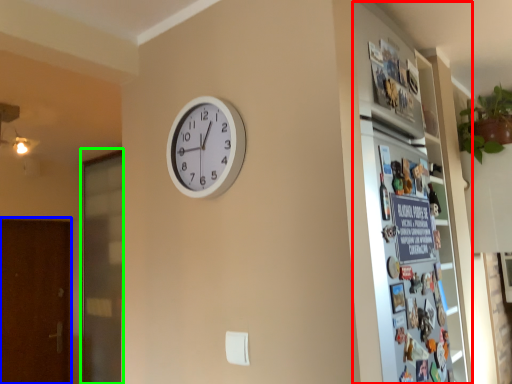
Question: Considering the real-world distances, which object is farthest from fridge (highlighted by a red box)? screen door (highlighted by a blue box) or screen door (highlighted by a green box)?

Choices:
 (A) screen door
 (B) screen door

Answer: (A)